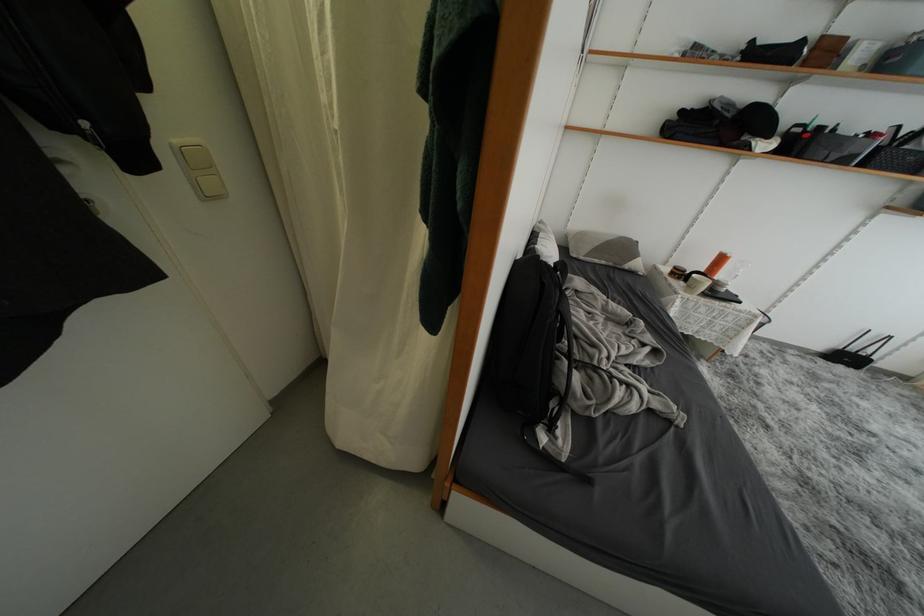
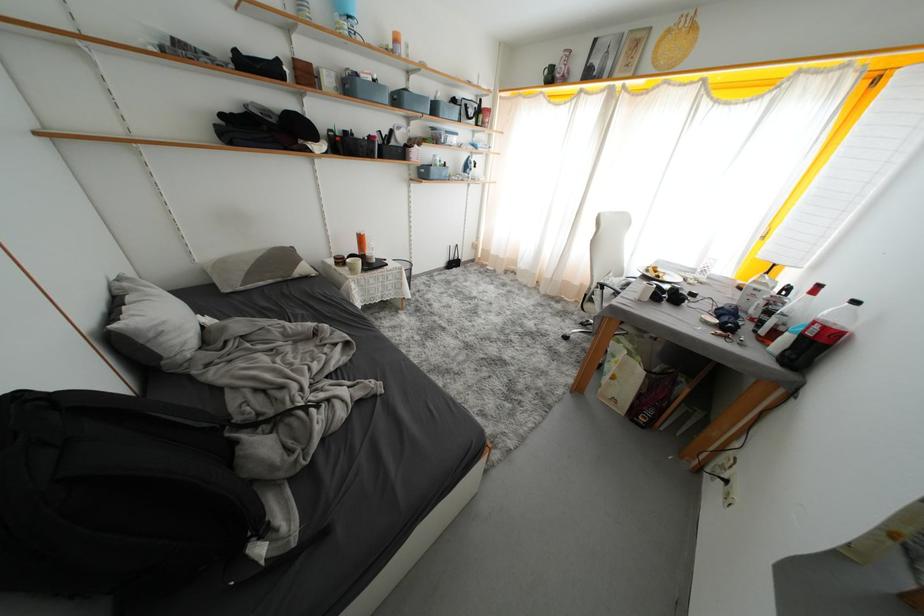
The first image is from the beginning of the video and the second image is from the end. How did the camera likely rotate when shooting the video?

The camera rotated toward right-down.